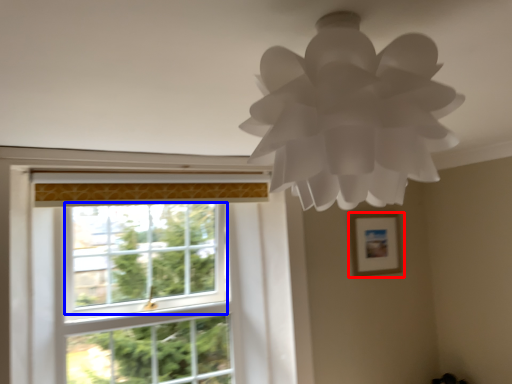
Question: Which point is closer to the camera, picture frame (highlighted by a red box) or window screen (highlighted by a blue box)?

Choices:
 (A) picture frame
 (B) window screen

Answer: (B)